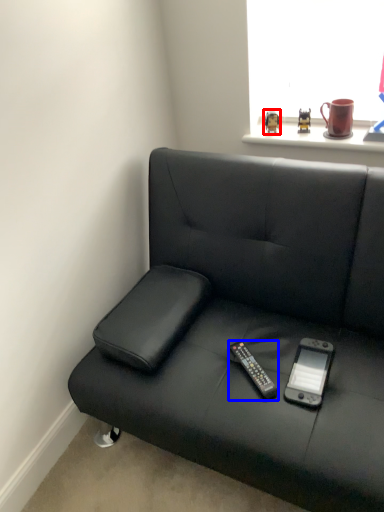
Question: Which point is closer to the camera, toy (highlighted by a red box) or remote (highlighted by a blue box)?

Choices:
 (A) toy
 (B) remote

Answer: (B)